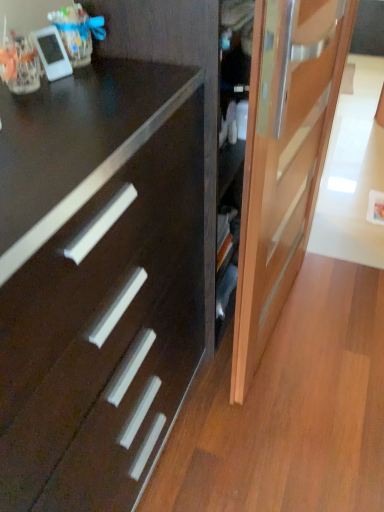
You are a GUI agent. You are given a task and a screenshot of the screen. Output one action in this format:
    pyautogui.click(x=<x>, y=<y>)
    Task: Click on the vacant area on top of dark wood drawer at center (from a real-world perspective)
    The height and width of the screenshot is (512, 384).
    Given the screenshot: What is the action you would take?
    pyautogui.click(x=59, y=115)